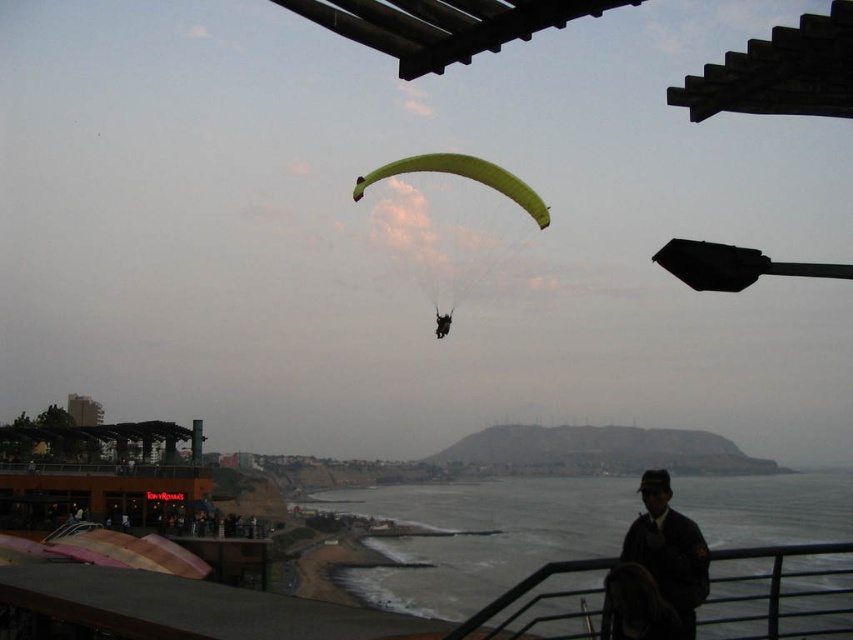
Between clear water at lower center and green fabric parachute at center, which one is positioned lower?

clear water at lower center

Who is more forward, (492, 493) or (505, 195)?

Point (505, 195) is in front.

Where is `clear water at lower center`? clear water at lower center is located at coordinates (483, 536).

Can you confirm if clear water at lower center is positioned to the left of dark brown leather jacket at lower right?

Incorrect, clear water at lower center is not on the left side of dark brown leather jacket at lower right.

Looking at this image, does clear water at lower center have a lesser height compared to dark brown leather jacket at lower right?

Yes, clear water at lower center is shorter than dark brown leather jacket at lower right.

Does point (581, 515) lie in front of point (683, 522)?

That is False.

Where is `clear water at lower center`? The width and height of the screenshot is (853, 640). clear water at lower center is located at coordinates (483, 536).

Measure the distance between point (669, 515) and camera.

The distance of point (669, 515) from camera is 205.27 feet.

Is dark brown leather jacket at lower right closer to camera compared to green fabric parachute at center?

Yes, dark brown leather jacket at lower right is closer to the viewer.

Does point (624, 554) lie in front of point (445, 324)?

Yes, point (624, 554) is closer to viewer.

The image size is (853, 640). I want to click on dark brown leather jacket at lower right, so click(x=668, y=548).